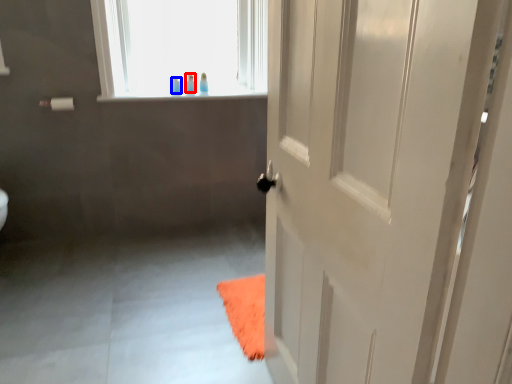
Question: Which point is further to the camera, toiletry (highlighted by a red box) or toiletry (highlighted by a blue box)?

Choices:
 (A) toiletry
 (B) toiletry

Answer: (A)